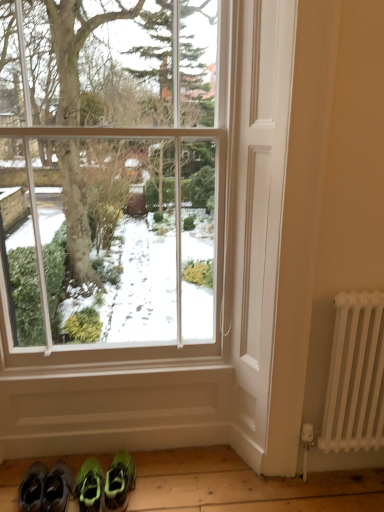
Question: From the image's perspective, is green suede sneakers at lower left, the third footwear viewed from the right, located above or below green suede sneakers at lower left, which appears as the 2th footwear when viewed from the left?

Choices:
 (A) above
 (B) below

Answer: (A)

Question: From a real-world perspective, is green suede sneakers at lower left, the third footwear viewed from the right, positioned above or below green suede sneakers at lower left, the second footwear in the right-to-left sequence?

Choices:
 (A) below
 (B) above

Answer: (B)

Question: Considering the real-world distances, which object is farthest from the green suede sneakers at lower left, which appears as the 2th footwear when viewed from the left?

Choices:
 (A) green suede sneakers at lower left, which is the first footwear from left to right
 (B) white metal radiator at right
 (C) green synthetic sneakers at lower center, the first footwear positioned from the right
 (D) clear glass window at center

Answer: (D)

Question: Considering the real-world distances, which object is farthest from the green suede sneakers at lower left, which is the first footwear from left to right?

Choices:
 (A) green suede sneakers at lower left, the second footwear in the right-to-left sequence
 (B) green synthetic sneakers at lower center, the first footwear positioned from the right
 (C) clear glass window at center
 (D) white metal radiator at right

Answer: (D)